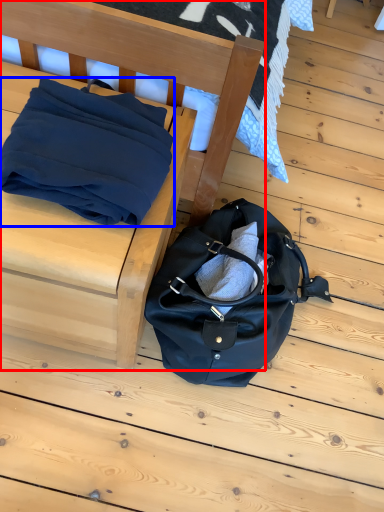
Question: Among these objects, which one is nearest to the camera, furniture (highlighted by a red box) or blanket (highlighted by a blue box)?

Choices:
 (A) furniture
 (B) blanket

Answer: (A)